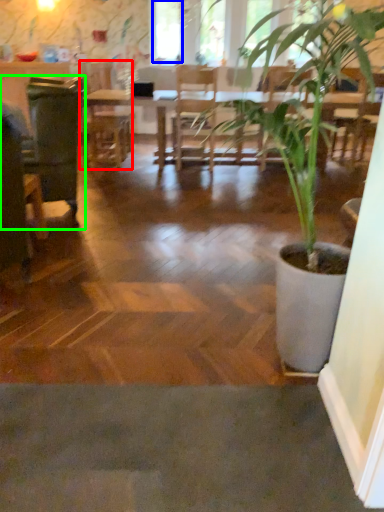
Question: Which object is the farthest from armchair (highlighted by a red box)? Choose among these: window screen (highlighted by a blue box) or swivel chair (highlighted by a green box).

Choices:
 (A) window screen
 (B) swivel chair

Answer: (B)